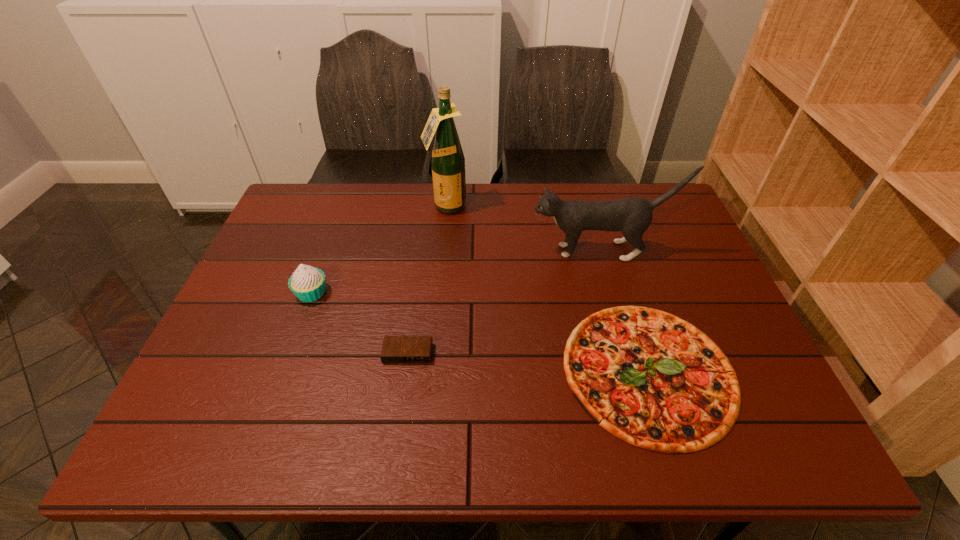
This screenshot has width=960, height=540. In order to click on free spot that satisfies the following two spatial constraints: 1. on the front face of the alarm clock; 2. on the left side of the pizza in this screenshot , I will do `click(405, 370)`.

Identify the location of free space in the image that satisfies the following two spatial constraints: 1. at the face of the second farthest object; 2. on the front side of the leftmost object. This screenshot has width=960, height=540. (612, 293).

Where is `free spot that satisfies the following two spatial constraints: 1. at the face of the fourth shortest object; 2. on the right side of the pizza`? This screenshot has height=540, width=960. free spot that satisfies the following two spatial constraints: 1. at the face of the fourth shortest object; 2. on the right side of the pizza is located at coordinates (636, 370).

Where is `free space in the image that satisfies the following two spatial constraints: 1. at the face of the cat; 2. on the front face of the second shortest object`? The image size is (960, 540). free space in the image that satisfies the following two spatial constraints: 1. at the face of the cat; 2. on the front face of the second shortest object is located at coordinates (631, 353).

The image size is (960, 540). In order to click on free region that satisfies the following two spatial constraints: 1. at the face of the cat; 2. on the front face of the alarm clock in this screenshot , I will do `click(631, 353)`.